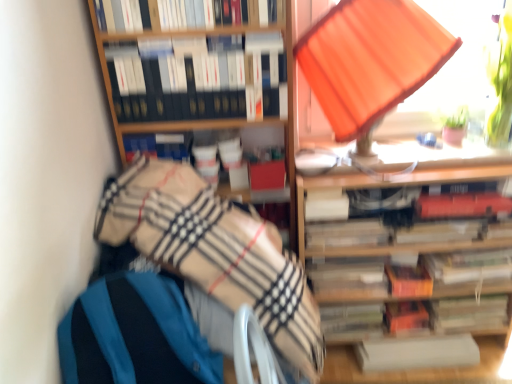
The height and width of the screenshot is (384, 512). Describe the element at coordinates (215, 251) in the screenshot. I see `beige plaid blanket at lower left` at that location.

Find the location of a particular element. hardcover book at center, positioned as the 3th paperback book in top-to-bottom order is located at coordinates (440, 231).

Image resolution: width=512 pixels, height=384 pixels. In order to click on hardcover book at center, which is the 7th paperback book from top to bottom in this screenshot , I will do `click(468, 313)`.

Describe the element at coordinates (468, 313) in the screenshot. The image size is (512, 384). I see `hardcover book at center, which is the 7th paperback book from top to bottom` at that location.

The width and height of the screenshot is (512, 384). Describe the element at coordinates (326, 205) in the screenshot. I see `white paper at center, acting as the 8th paperback book starting from the bottom` at that location.

Where is `white paper at lower right, the 4th book viewed from the front`? This screenshot has height=384, width=512. white paper at lower right, the 4th book viewed from the front is located at coordinates (417, 352).

You are a GUI agent. You are given a task and a screenshot of the screen. Output one action in this format:
    pyautogui.click(x=<x>, y=<y>)
    Task: Click on the blue fabric rocking chair at lower left
    The height and width of the screenshot is (384, 512).
    Given the screenshot: What is the action you would take?
    pyautogui.click(x=134, y=335)

From their relative heights in the image, would you say orange matte book at center, the 2th paperback book positioned from the bottom, is taller or shorter than white paper at lower right, which is the fourth book in top-to-bottom order?

Clearly, orange matte book at center, the 2th paperback book positioned from the bottom, is taller compared to white paper at lower right, which is the fourth book in top-to-bottom order.

The height and width of the screenshot is (384, 512). What are the coordinates of `the 1st paperback book above the white paper at lower right, the 1th book from the back (from a real-world perspective)` in the screenshot? It's located at (405, 316).

Is orange matte book at center, acting as the eighth paperback book starting from the top, positioned beyond the bounds of white paper at lower right, which is the fourth book in top-to-bottom order?

orange matte book at center, acting as the eighth paperback book starting from the top, is positioned outside white paper at lower right, which is the fourth book in top-to-bottom order.

Is wooden bookshelf at upper right smaller than hardcover book at center, which is counted as the 2th book, starting from the back?

Actually, wooden bookshelf at upper right might be larger than hardcover book at center, which is counted as the 2th book, starting from the back.

Considering the positions of objects wooden bookshelf at upper right and hardcover book at center, which is the 3th book in front-to-back order, in the image provided, who is more to the left, wooden bookshelf at upper right or hardcover book at center, which is the 3th book in front-to-back order,?

From the viewer's perspective, wooden bookshelf at upper right appears more on the left side.

From a real-world perspective, which is physically below, wooden bookshelf at upper right or hardcover book at center, the second book in the bottom-to-top sequence?

In real-world perspective, hardcover book at center, the second book in the bottom-to-top sequence, is lower.

From the image's perspective, is wooden bookshelf at upper right above hardcover book at center, which is counted as the 2th book, starting from the back?

Yes, from the image's perspective, wooden bookshelf at upper right is above hardcover book at center, which is counted as the 2th book, starting from the back.

Does blue fabric rocking chair at lower left have a greater height compared to hardcover book at center, which is the 3th book in front-to-back order?

Yes, blue fabric rocking chair at lower left is taller than hardcover book at center, which is the 3th book in front-to-back order.

Consider the image. Which is more to the left, blue fabric rocking chair at lower left or hardcover book at center, the 3th book from the top?

From the viewer's perspective, blue fabric rocking chair at lower left appears more on the left side.

Does blue fabric rocking chair at lower left have a lesser width compared to hardcover book at center, which is the 3th book in front-to-back order?

Incorrect, the width of blue fabric rocking chair at lower left is not less than that of hardcover book at center, which is the 3th book in front-to-back order.

Are blue fabric rocking chair at lower left and hardcover book at center, the 3th book from the top, located far from each other?

Yes, blue fabric rocking chair at lower left and hardcover book at center, the 3th book from the top, are quite far apart.

Relative to blue fabric rocking chair at lower left, is black matte file at upper center, which is the 3th book from bottom to top, in front or behind?

Visually, black matte file at upper center, which is the 3th book from bottom to top, is located behind blue fabric rocking chair at lower left.

From a real-world perspective, is black matte file at upper center, the 2th book from the top, physically above blue fabric rocking chair at lower left?

Indeed, from a real-world perspective, black matte file at upper center, the 2th book from the top, stands above blue fabric rocking chair at lower left.

Consider the image. How far apart are black matte file at upper center, which is the 3th book from bottom to top, and blue fabric rocking chair at lower left?

black matte file at upper center, which is the 3th book from bottom to top, and blue fabric rocking chair at lower left are 26.12 inches apart from each other.

Would you say black matte file at upper center, positioned as the third book in back-to-front order, is outside blue fabric rocking chair at lower left?

Indeed, black matte file at upper center, positioned as the third book in back-to-front order, is completely outside blue fabric rocking chair at lower left.

Does point (414, 323) come behind point (336, 199)?

Yes, point (414, 323) is behind point (336, 199).

From a real-world perspective, who is located higher, orange matte book at center, acting as the eighth paperback book starting from the top, or white paper at center, the 2th paperback book positioned from the top?

white paper at center, the 2th paperback book positioned from the top, from a real-world perspective.

Is orange matte book at center, the 2th paperback book positioned from the bottom, in front of white paper at center, acting as the 8th paperback book starting from the bottom?

That is False.

Is point (387, 282) farther from camera compared to point (388, 237)?

Yes, it is behind point (388, 237).

From the image's perspective, would you say hardcover book at center, which is counted as the 5th paperback book, starting from the top, is shown under hardcover book at center, arranged as the 4th paperback book when viewed from the top?

Yes.

Starting from the hardcover book at center, acting as the 5th paperback book starting from the bottom, which paperback book is the 1st one in front? Please provide its 2D coordinates.

[(347, 233)]

Does hardcover book at center, acting as the 5th paperback book starting from the bottom, turn towards hardcover book at center, arranged as the 4th paperback book when viewed from the top?

No.

From a real-world perspective, is orange fabric lampshade at upper right located beneath orange matte book at center, the 2th paperback book positioned from the bottom?

No, from a real-world perspective, orange fabric lampshade at upper right is not below orange matte book at center, the 2th paperback book positioned from the bottom.

Considering the positions of objects orange fabric lampshade at upper right and orange matte book at center, the 2th paperback book positioned from the bottom, in the image provided, who is more to the left, orange fabric lampshade at upper right or orange matte book at center, the 2th paperback book positioned from the bottom,?

orange fabric lampshade at upper right is more to the left.

From the picture: From the image's perspective, which is above, orange fabric lampshade at upper right or orange matte book at center, acting as the eighth paperback book starting from the top?

orange fabric lampshade at upper right is shown above in the image.

Is orange fabric lampshade at upper right positioned far away from orange matte book at center, acting as the eighth paperback book starting from the top?

They are positioned close to each other.

Image resolution: width=512 pixels, height=384 pixels. I want to click on book below the orange matte book at center, acting as the eighth paperback book starting from the top (from a real-world perspective), so (x=417, y=352).

Find the location of a particular element. The image size is (512, 384). the 2nd book to the right of the wooden bookshelf at upper right, counting from the anchor's position is located at coordinates (469, 265).

Estimate the real-world distances between objects in this image. Which object is further from hardcover book at center, which is the 7th paperback book from top to bottom, white paper at lower right, the 1th book from the back, or orange fabric lampshade at upper right?

Among the two, orange fabric lampshade at upper right is located further to hardcover book at center, which is the 7th paperback book from top to bottom.

Estimate the real-world distances between objects in this image. Which object is closer to orange matte book at center, the 6th paperback book viewed from the top, white paper at lower right, which is the fourth book in top-to-bottom order, or hardcover book at center, arranged as the 6th paperback book when ordered from the bottom?

hardcover book at center, arranged as the 6th paperback book when ordered from the bottom.

Based on their spatial positions, is hardcover book at center, positioned as the 3th paperback book in top-to-bottom order, or orange matte book at center, the 6th paperback book viewed from the top, closer to hardcover book at center, acting as the first paperback book starting from the bottom?

Among the two, orange matte book at center, the 6th paperback book viewed from the top, is located nearer to hardcover book at center, acting as the first paperback book starting from the bottom.

Based on their spatial positions, is white paper at center, the 2th paperback book positioned from the top, or hardcover book at center, which is the 7th paperback book from top to bottom, closer to hardcover book at center right, which is the first paperback book in top-to-bottom order?

The object closer to hardcover book at center right, which is the first paperback book in top-to-bottom order, is white paper at center, the 2th paperback book positioned from the top.

Which object lies further to the anchor point hardcover book at center right, which is the first paperback book in top-to-bottom order, orange fabric lampshade at upper right or beige plaid blanket at lower left?

beige plaid blanket at lower left is positioned further to the anchor hardcover book at center right, which is the first paperback book in top-to-bottom order.

Estimate the real-world distances between objects in this image. Which object is further from orange fabric lampshade at upper right, orange matte book at center, the 6th paperback book viewed from the top, or white paper at lower right, the 4th book viewed from the front?

white paper at lower right, the 4th book viewed from the front.

From the image, which object appears to be nearer to blue fabric rocking chair at lower left, beige plaid blanket at lower left or orange fabric lampshade at upper right?

beige plaid blanket at lower left lies closer to blue fabric rocking chair at lower left than the other object.

Estimate the real-world distances between objects in this image. Which object is further from wooden bookshelf at upper right, orange fabric lampshade at upper right or orange matte book at center, acting as the eighth paperback book starting from the top?

Based on the image, orange fabric lampshade at upper right appears to be further to wooden bookshelf at upper right.

Identify the location of book that lies between orange fabric lampshade at upper right and orange matte book at center, which is the 4th paperback book from bottom to top, from top to bottom. (469, 265).

The image size is (512, 384). In order to click on lamp that lies between black matte file at upper center, which is the 3th book from bottom to top, and beige plaid blanket at lower left from top to bottom in this screenshot , I will do `click(370, 61)`.

Where is `shelf between orange fabric lampshade at upper right and hardcover book at center, which is counted as the 5th paperback book, starting from the top, from top to bottom`? The image size is (512, 384). shelf between orange fabric lampshade at upper right and hardcover book at center, which is counted as the 5th paperback book, starting from the top, from top to bottom is located at coordinates (398, 186).

In order to click on rocking chair between black matte file at upper center, which is the 3th book from bottom to top, and white paper at lower right, marked as the 1th book in a bottom-to-top arrangement, in the up-down direction in this screenshot , I will do `click(134, 335)`.